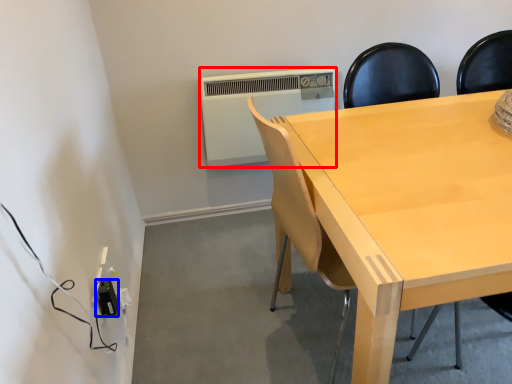
Question: Which of the following is the closest to the observer, air conditioning (highlighted by a red box) or electric outlet (highlighted by a blue box)?

Choices:
 (A) air conditioning
 (B) electric outlet

Answer: (B)